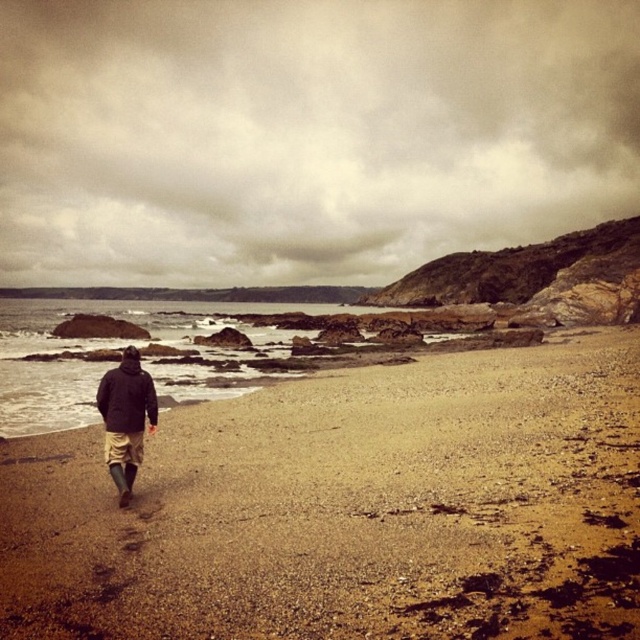
Based on the scene description, which object occupies a larger portion of the image between the cloudy sky at upper center and the dark brown leather jacket at center?

The cloudy sky at upper center is bigger than the dark brown leather jacket at center, so the cloudy sky at upper center occupies a larger portion of the image.

You are a photographer planning to capture a landscape shot of the cloudy sky at upper center and the dark brown leather jacket at center. Given the distance between them, can you estimate if they can be framed in a single shot without moving the camera?

The cloudy sky at upper center and dark brown leather jacket at center are 623.53 meters apart from each other. Depending on the camera lens used, this distance may require a wide angle or zoom lens to capture both in one frame. However, without specific lens details, it is difficult to confirm if they can be framed together without moving the camera.